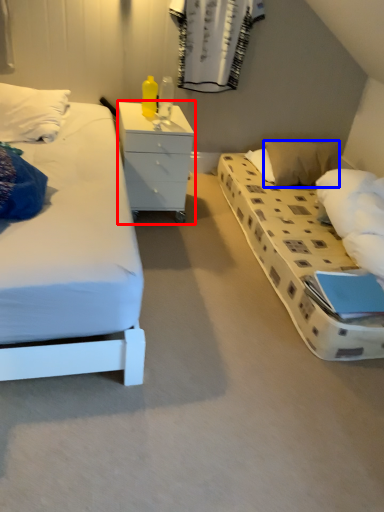
Question: Which object appears closest to the camera in this image, chest of drawers (highlighted by a red box) or pillow (highlighted by a blue box)?

Choices:
 (A) chest of drawers
 (B) pillow

Answer: (A)